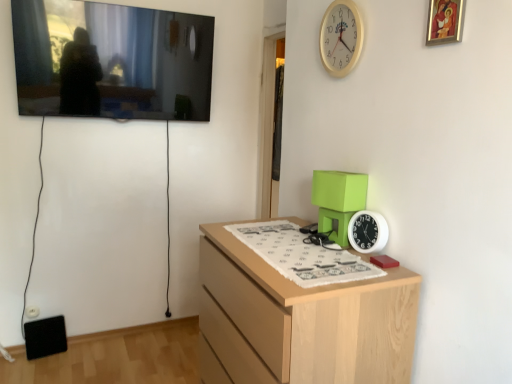
Question: Is white plastic clock at upper right, the 1th clock viewed from the top, to the left or to the right of light wood chest of drawers at center in the image?

Choices:
 (A) right
 (B) left

Answer: (A)

Question: Considering the positions of point (338, 48) and point (249, 309), is point (338, 48) closer or farther from the camera than point (249, 309)?

Choices:
 (A) closer
 (B) farther

Answer: (B)

Question: Estimate the real-world distances between objects in this image. Which object is farther from the white plastic clock at right, which is counted as the 1th clock, starting from the bottom?

Choices:
 (A) flat screen tv at upper left, placed as the first picture frame when sorted from left to right
 (B) white plastic clock at upper right, placed as the second clock when sorted from bottom to top
 (C) light wood chest of drawers at center
 (D) gold-framed painting at upper right, positioned as the 2th picture frame in left-to-right order

Answer: (A)

Question: Which object is the closest to the white plastic clock at right, the 2th clock viewed from the top?

Choices:
 (A) gold-framed painting at upper right, positioned as the 2th picture frame in left-to-right order
 (B) white plastic clock at upper right, placed as the second clock when sorted from bottom to top
 (C) flat screen tv at upper left, placed as the first picture frame when sorted from left to right
 (D) light wood chest of drawers at center

Answer: (D)